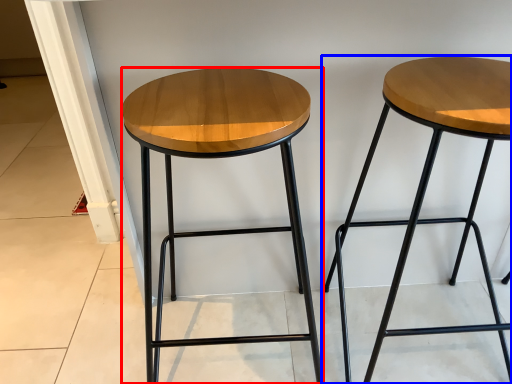
Question: Which object appears closest to the camera in this image, stool (highlighted by a red box) or stool (highlighted by a blue box)?

Choices:
 (A) stool
 (B) stool

Answer: (A)